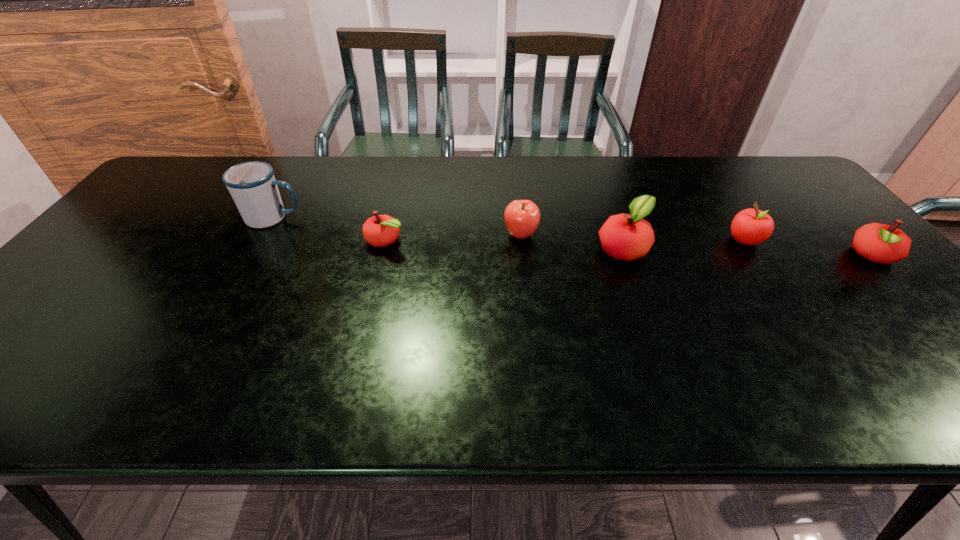
This screenshot has width=960, height=540. Identify the location of free space located on the back of the third apple from left to right. pos(611,213).

Find the location of a particular element. This screenshot has height=540, width=960. vacant space located 0.110m on the left of the fifth tallest object is located at coordinates (804, 255).

Where is `free space located on the front of the fifth object from left to right`? free space located on the front of the fifth object from left to right is located at coordinates (800, 321).

Where is `free spot located 0.050m on the right of the fourth object from right to left`? The image size is (960, 540). free spot located 0.050m on the right of the fourth object from right to left is located at coordinates (556, 234).

Image resolution: width=960 pixels, height=540 pixels. I want to click on free location located on the handle side of the leftmost object, so point(383,218).

Image resolution: width=960 pixels, height=540 pixels. In order to click on object that is positioned at the right edge in this screenshot , I will do `click(881, 243)`.

Find the location of `vacant point at the far edge`. vacant point at the far edge is located at coordinates (722, 163).

You are a GUI agent. You are given a task and a screenshot of the screen. Output one action in this format:
    pyautogui.click(x=<x>, y=<y>)
    Task: Click on the vacant space at the near edge of the desktop
    The width and height of the screenshot is (960, 540).
    Given the screenshot: What is the action you would take?
    pyautogui.click(x=135, y=352)

The height and width of the screenshot is (540, 960). What are the coordinates of `vacant space at the left edge of the desktop` in the screenshot? It's located at (76, 294).

This screenshot has width=960, height=540. In the image, there is a desktop. Identify the location of vacant area at the right edge. (892, 291).